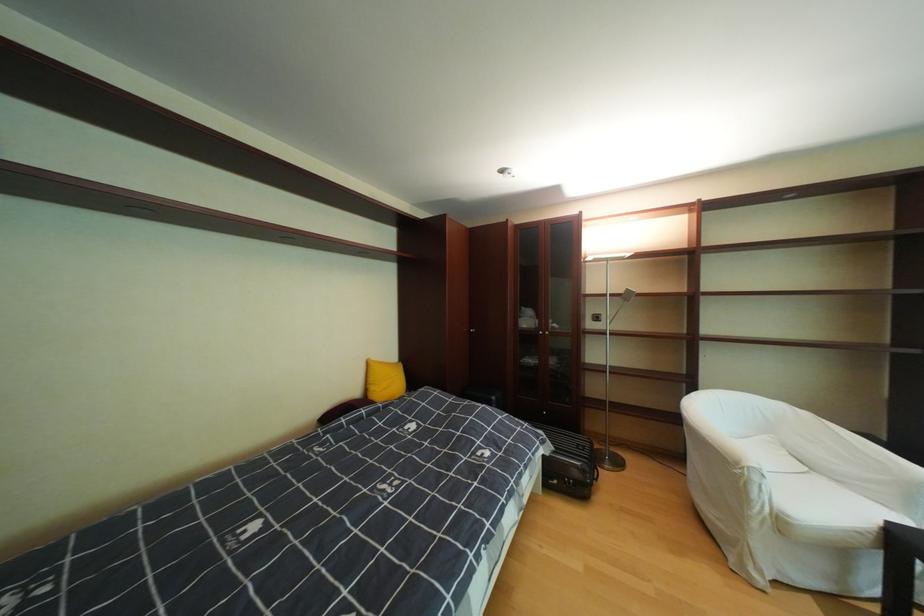
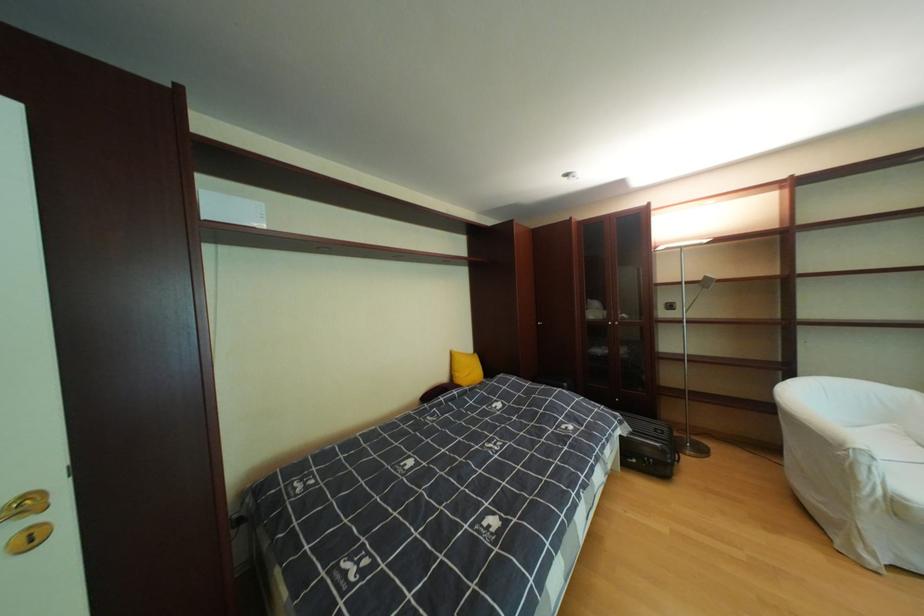
Where in the second image is the point corresponding to point 368,394 from the first image?

(456, 379)